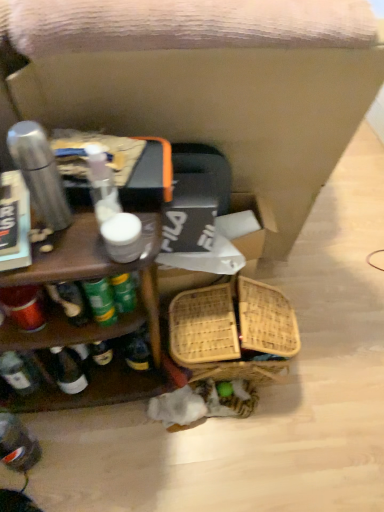
Question: Do you think woven bamboo basket at lower center is within woven cardboard box at center, or outside of it?

Choices:
 (A) outside
 (B) inside

Answer: (A)

Question: From the image's perspective, is woven bamboo basket at lower center located above or below woven cardboard box at center?

Choices:
 (A) above
 (B) below

Answer: (B)

Question: Considering the real-world distances, which object is farthest from the wooden swivel chair at center?

Choices:
 (A) translucent plastic bottle at lower left
 (B) woven bamboo basket at lower center
 (C) woven cardboard box at center
 (D) wooden shelf at left

Answer: (A)

Question: Which of these objects is positioned closest to the wooden shelf at left?

Choices:
 (A) woven bamboo basket at lower center
 (B) translucent plastic bottle at lower left
 (C) woven cardboard box at center
 (D) wooden swivel chair at center

Answer: (A)